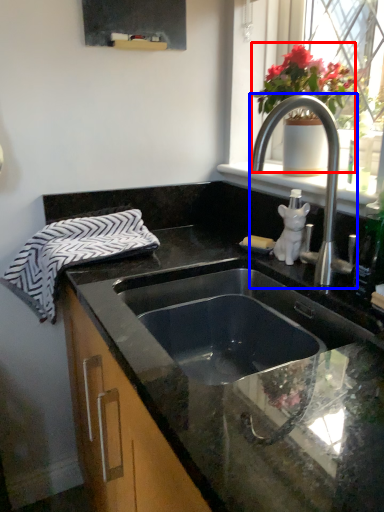
Question: Which object appears farthest to the camera in this image, floral arrangement (highlighted by a red box) or tap (highlighted by a blue box)?

Choices:
 (A) floral arrangement
 (B) tap

Answer: (A)